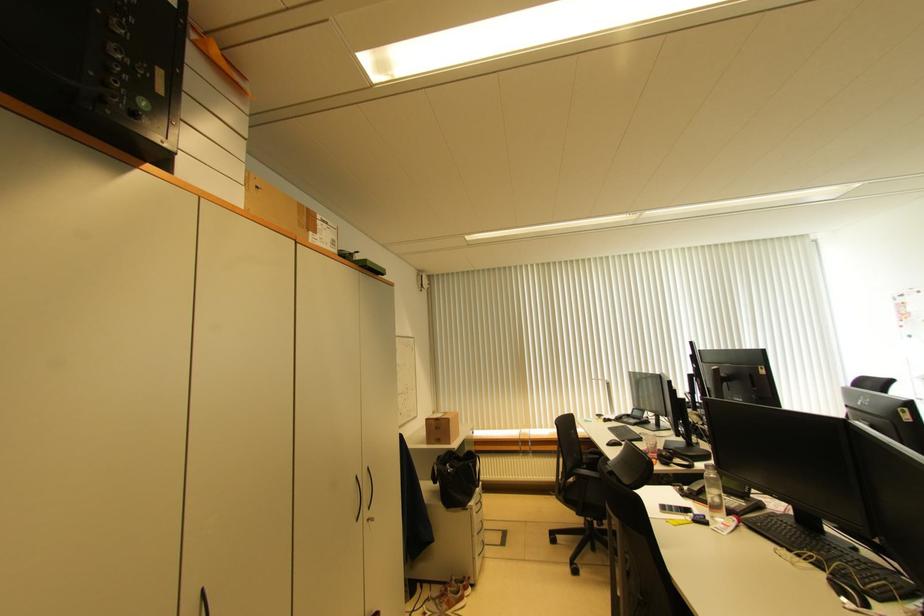
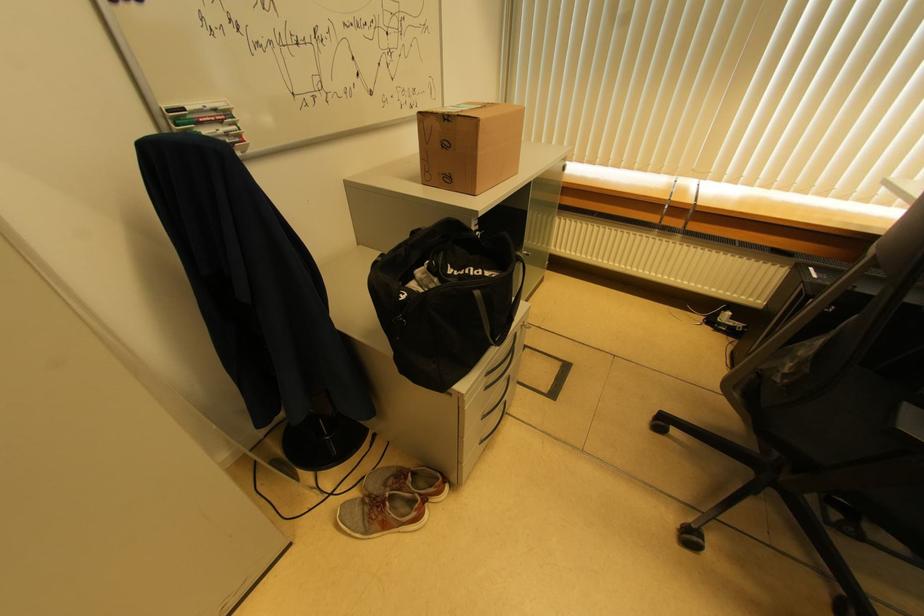
In the second image, find the point that corresponds to [472,467] in the first image.

(479, 296)